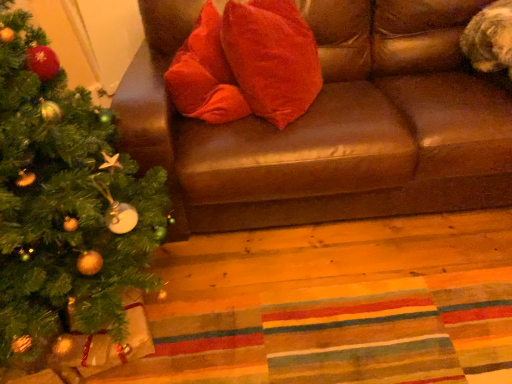
Question: Is brown leather couch at upper center to the left of green matte christmas tree at left from the viewer's perspective?

Choices:
 (A) yes
 (B) no

Answer: (B)

Question: Can you confirm if brown leather couch at upper center is shorter than green matte christmas tree at left?

Choices:
 (A) no
 (B) yes

Answer: (B)

Question: Considering the relative positions of brown leather couch at upper center and green matte christmas tree at left in the image provided, is brown leather couch at upper center behind green matte christmas tree at left?

Choices:
 (A) yes
 (B) no

Answer: (A)

Question: Would you say brown leather couch at upper center is a long distance from green matte christmas tree at left?

Choices:
 (A) yes
 (B) no

Answer: (B)

Question: Can you confirm if brown leather couch at upper center is bigger than green matte christmas tree at left?

Choices:
 (A) no
 (B) yes

Answer: (B)

Question: From the image's perspective, is green matte christmas tree at left positioned above or below brown leather couch at upper center?

Choices:
 (A) above
 (B) below

Answer: (B)

Question: Do you think green matte christmas tree at left is within brown leather couch at upper center, or outside of it?

Choices:
 (A) inside
 (B) outside

Answer: (B)

Question: In the image, is green matte christmas tree at left positioned in front of or behind brown leather couch at upper center?

Choices:
 (A) front
 (B) behind

Answer: (A)

Question: From a real-world perspective, is green matte christmas tree at left positioned above or below brown leather couch at upper center?

Choices:
 (A) above
 (B) below

Answer: (A)

Question: In the image, is brown leather couch at upper center on the left side or the right side of velvet red pillow at center?

Choices:
 (A) right
 (B) left

Answer: (A)

Question: Is point (337, 173) positioned closer to the camera than point (273, 87)?

Choices:
 (A) farther
 (B) closer

Answer: (B)

Question: Is brown leather couch at upper center wider or thinner than velvet red pillow at center?

Choices:
 (A) thin
 (B) wide

Answer: (B)

Question: From a real-world perspective, relative to velvet red pillow at center, is brown leather couch at upper center vertically above or below?

Choices:
 (A) below
 (B) above

Answer: (A)

Question: Relative to brown leather couch at upper center, is velvet red pillow at center in front or behind?

Choices:
 (A) front
 (B) behind

Answer: (B)

Question: In terms of height, does velvet red pillow at center look taller or shorter compared to brown leather couch at upper center?

Choices:
 (A) short
 (B) tall

Answer: (A)